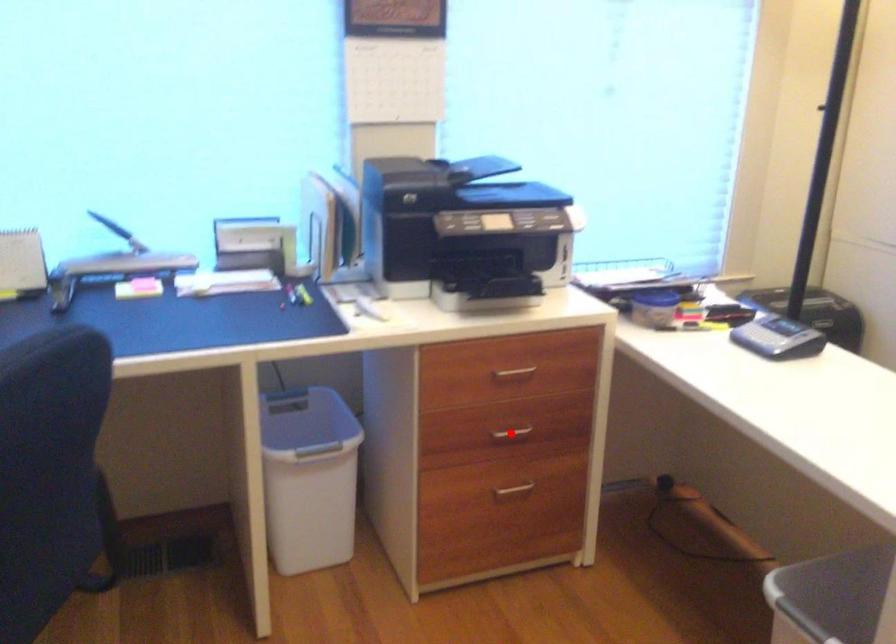
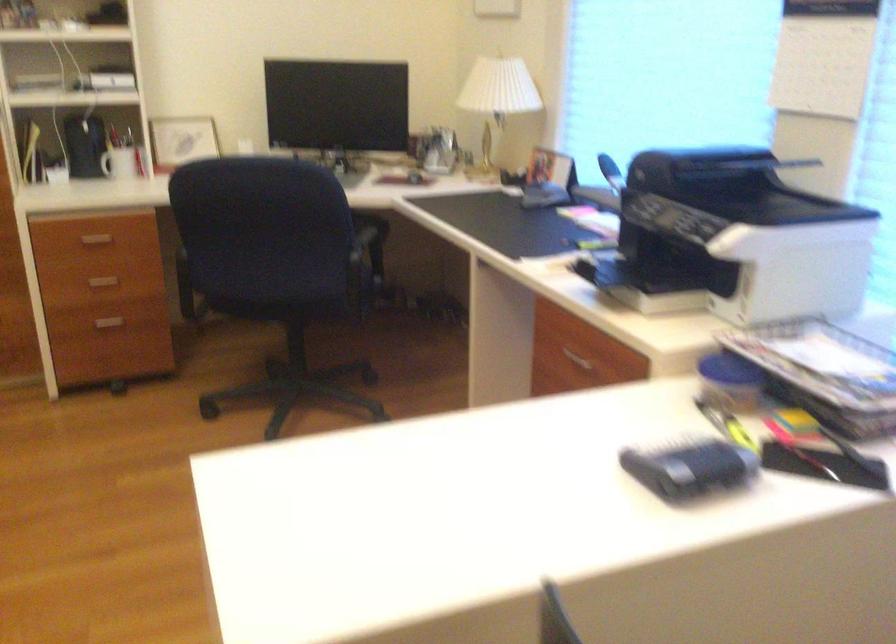
Question: I am providing you with two images of the same scene from different viewpoints. A red point is marked on the first image. At the location where the point appears in image 1, is it still visible in image 2?

Choices:
 (A) Yes
 (B) No

Answer: (B)